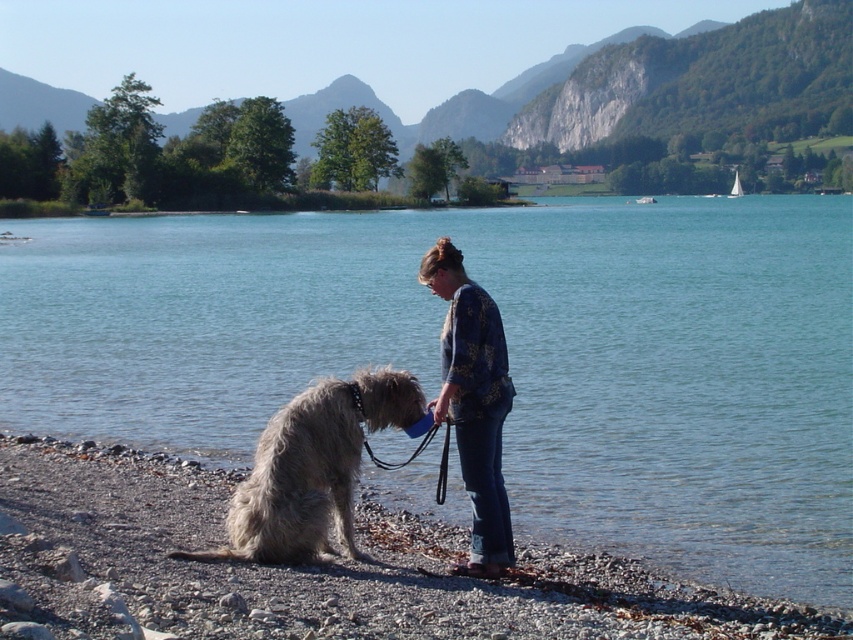
You are planning to build a small sandcastle on the lakeside. The smooth pebbles shoreline at lower left and the gray shaggy fur at lower left are both present. Which material would be more suitable for building the sandcastle, and why?

The smooth pebbles shoreline at lower left would be more suitable for building the sandcastle because they are larger in size compared to the gray shaggy fur at lower left, making them more stable and easier to stack.